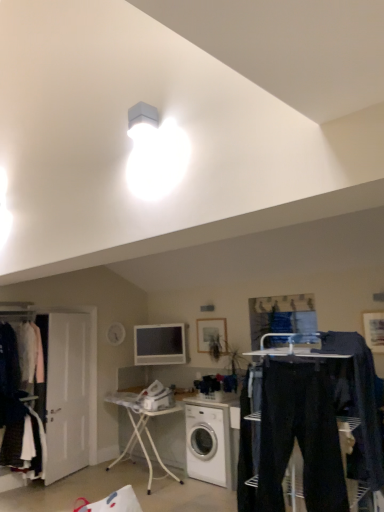
Question: Can you confirm if white glossy washing machine at center is thinner than dark blue jeans at center?

Choices:
 (A) no
 (B) yes

Answer: (A)

Question: Does white glossy washing machine at center have a greater height compared to dark blue jeans at center?

Choices:
 (A) yes
 (B) no

Answer: (B)

Question: Does white glossy washing machine at center appear on the left side of dark blue jeans at center?

Choices:
 (A) no
 (B) yes

Answer: (B)

Question: Considering the relative sizes of white glossy washing machine at center and dark blue jeans at center in the image provided, is white glossy washing machine at center wider than dark blue jeans at center?

Choices:
 (A) no
 (B) yes

Answer: (B)

Question: Does white glossy washing machine at center have a larger size compared to dark blue jeans at center?

Choices:
 (A) no
 (B) yes

Answer: (B)

Question: Looking at the image, does dark blue jeans at center seem bigger or smaller compared to white glossy washing machine at center?

Choices:
 (A) small
 (B) big

Answer: (A)

Question: Is dark blue jeans at center taller or shorter than white glossy washing machine at center?

Choices:
 (A) tall
 (B) short

Answer: (A)

Question: From a real-world perspective, is dark blue jeans at center physically located above or below white glossy washing machine at center?

Choices:
 (A) above
 (B) below

Answer: (A)

Question: Which is correct: dark blue jeans at center is inside white glossy washing machine at center, or outside of it?

Choices:
 (A) outside
 (B) inside

Answer: (A)

Question: From the image's perspective, is wooden framed picture at right, the second picture frame viewed from the back, above or below white glossy television at center?

Choices:
 (A) below
 (B) above

Answer: (B)

Question: Does point (379, 344) appear closer or farther from the camera than point (183, 339)?

Choices:
 (A) closer
 (B) farther

Answer: (A)

Question: From a real-world perspective, is wooden framed picture at right, the second picture frame when ordered from left to right, above or below white glossy television at center?

Choices:
 (A) above
 (B) below

Answer: (A)

Question: From their relative heights in the image, would you say wooden framed picture at right, the second picture frame when ordered from left to right, is taller or shorter than white glossy television at center?

Choices:
 (A) short
 (B) tall

Answer: (A)

Question: Would you say white glossy washing machine at center is to the left or to the right of dark blue jeans at center in the picture?

Choices:
 (A) right
 (B) left

Answer: (B)

Question: From the image's perspective, is white glossy washing machine at center located above or below dark blue jeans at center?

Choices:
 (A) below
 (B) above

Answer: (A)